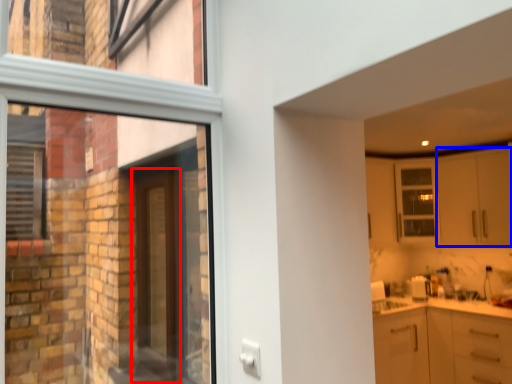
Question: Among these objects, which one is farthest to the camera, door (highlighted by a red box) or cabinetry (highlighted by a blue box)?

Choices:
 (A) door
 (B) cabinetry

Answer: (B)